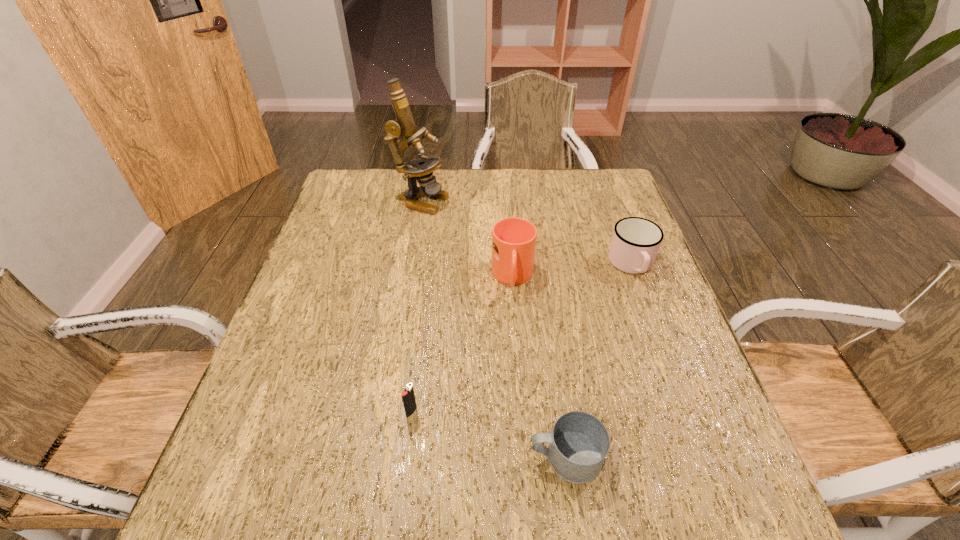
I want to click on blank area at the right edge, so coord(660,446).

The height and width of the screenshot is (540, 960). What are the coordinates of `vacant space that is in between the fourth shortest object and the fourth farthest object` in the screenshot? It's located at (462, 345).

Identify the location of free space between the tallest mug and the igniter. The height and width of the screenshot is (540, 960). (462, 345).

This screenshot has width=960, height=540. I want to click on vacant area that lies between the tallest object and the tallest mug, so click(x=467, y=239).

Locate an element on the screen. empty space between the fourth shortest object and the rightmost mug is located at coordinates (572, 271).

Image resolution: width=960 pixels, height=540 pixels. I want to click on free spot between the rightmost mug and the tallest mug, so click(572, 271).

I want to click on vacant area that lies between the second nearest object and the microscope, so (416, 306).

Identify the location of free space between the igniter and the tallest mug. (462, 345).

Find the location of a particular element. free space that is in between the tallest mug and the igniter is located at coordinates (462, 345).

Locate an element on the screen. object that is the fourth nearest to the nearest mug is located at coordinates (421, 169).